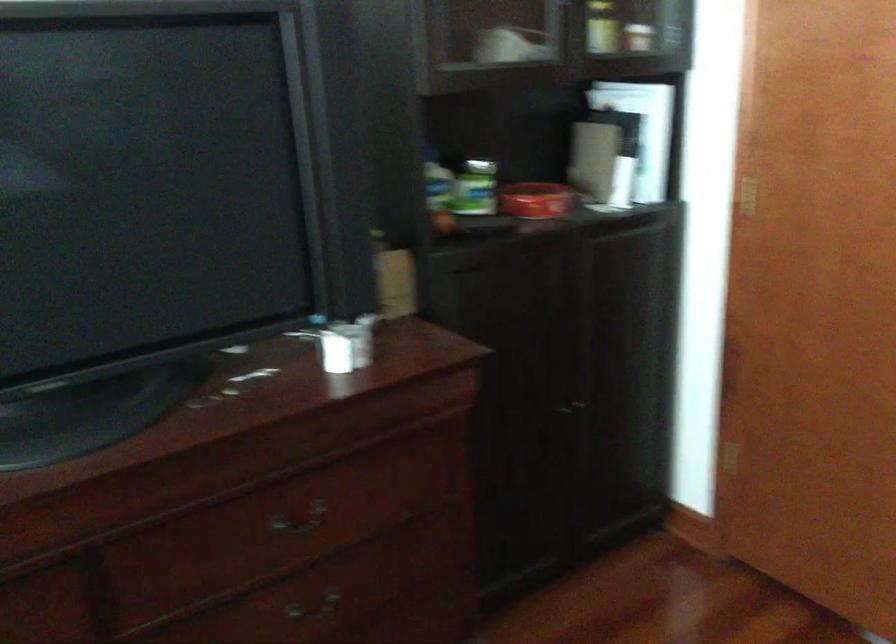
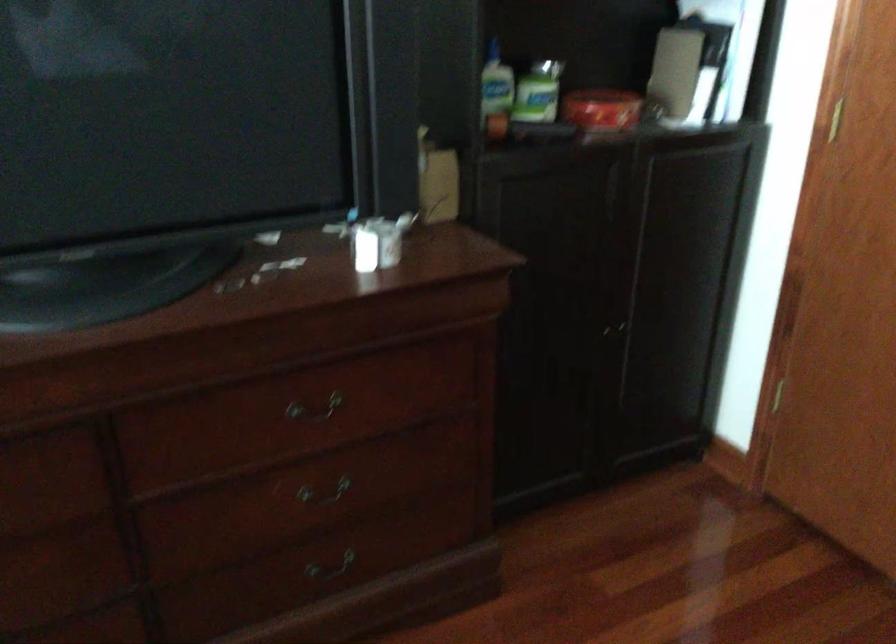
Which direction would the cameraman need to move to produce the second image?

The cameraman walked toward right, forward.